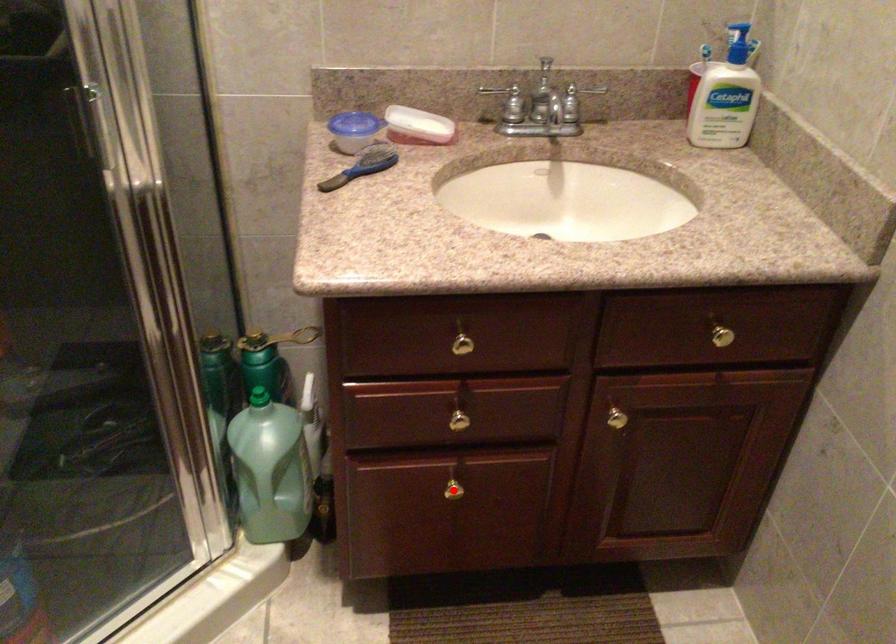
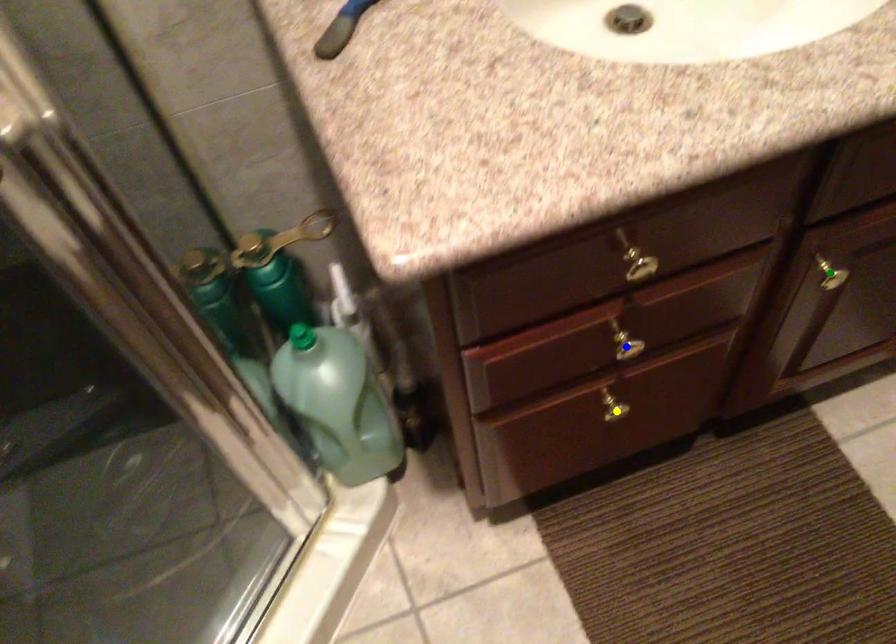
Question: I am providing you with two images of the same scene from different viewpoints. A red point is marked on the first image. You are given multiple points on the second image. Can you choose the point in image 2 that corresponds to the point in image 1?

Choices:
 (A) blue point
 (B) yellow point
 (C) green point

Answer: (B)